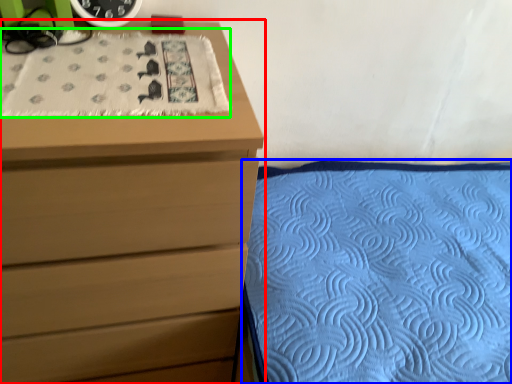
Question: Which is farther away from chest of drawers (highlighted by a red box)? mattress (highlighted by a blue box) or blanket (highlighted by a green box)?

Choices:
 (A) mattress
 (B) blanket

Answer: (A)